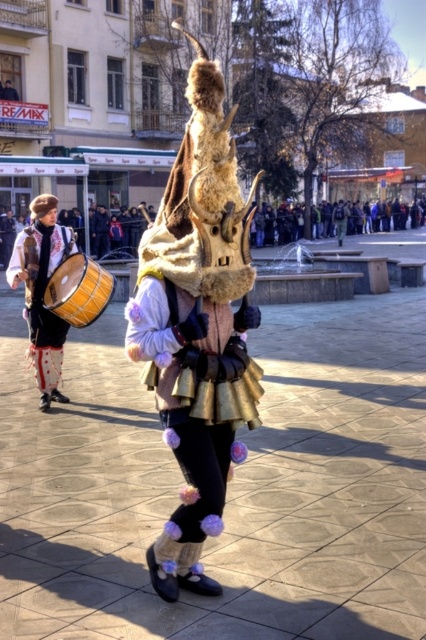
You are a street performer who needs to choose a drum for a parade. You have to carry it for an hour. Which drum between the matte brown drum at left and the wooden drum at center would be easier to carry for a longer duration?

The wooden drum at center is smaller and likely lighter than the matte brown drum at left, so it would be easier to carry for a longer duration.

You are a photographer trying to capture both the matte brown drum at left and the wooden drum at center in a single frame. Based on their heights, which drum should you focus on first to ensure both are fully visible in your photo?

The matte brown drum at left is much taller than the wooden drum at center. To ensure both are fully visible, focus on positioning the taller matte brown drum at left first, then adjust the frame to include the smaller wooden drum at center.

You are a photographer trying to capture the festive scene. You notice the matte brown drum at left and the wooden drum at center. Which drum is positioned lower in the image?

The matte brown drum at left is located below the wooden drum at center, so it is positioned lower in the image.